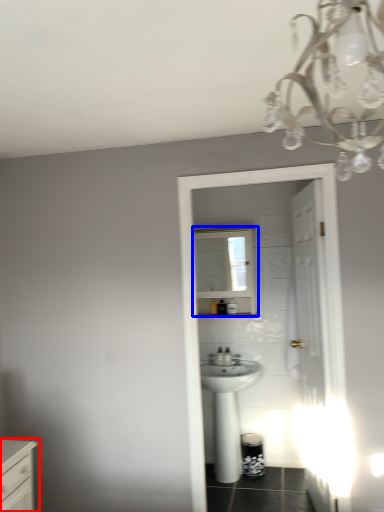
Question: Which of the following is the closest to the observer, chest of drawers (highlighted by a red box) or medicine cabinet (highlighted by a blue box)?

Choices:
 (A) chest of drawers
 (B) medicine cabinet

Answer: (A)